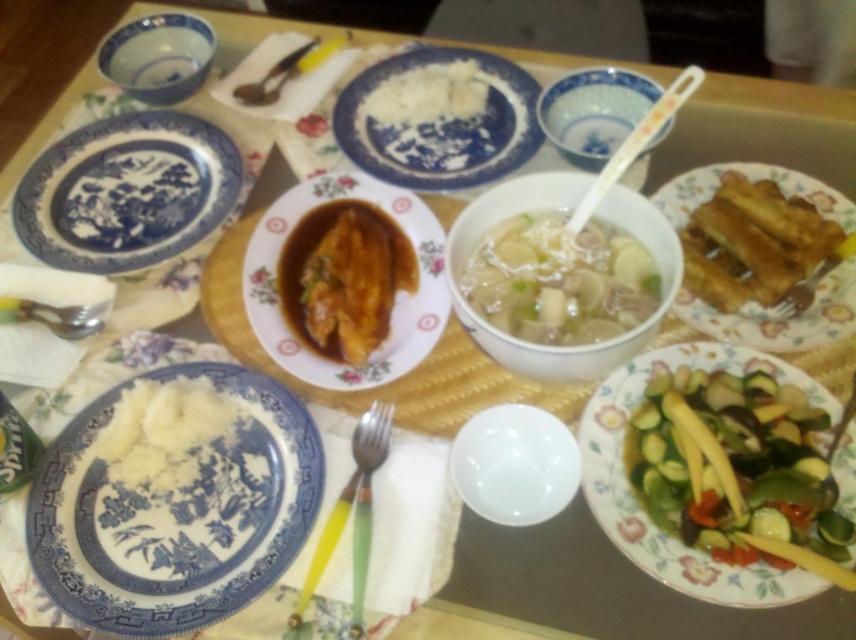
Question: Does blue porcelain bowl at upper left have a smaller size compared to green plastic fork at lower center?

Choices:
 (A) yes
 (B) no

Answer: (B)

Question: Is blue porcelain plate at center thinner than yellow-green plastic fork at center?

Choices:
 (A) no
 (B) yes

Answer: (A)

Question: Which of the following is the farthest from the observer?

Choices:
 (A) blue porcelain bowl at upper left
 (B) silver fork at right
 (C) white glossy bowl at center
 (D) silver metallic fork at center

Answer: (D)

Question: Is translucent glass soup at center to the left of yellow-green plastic fork at lower left from the viewer's perspective?

Choices:
 (A) no
 (B) yes

Answer: (A)

Question: Which point is closer to the camera?

Choices:
 (A) (188, 449)
 (B) (795, 333)

Answer: (A)

Question: Which object is the farthest from the white creamy mashed potato at lower left?

Choices:
 (A) yellow-green plastic fork at lower left
 (B) white porcelain plate at lower left
 (C) blue porcelain plate at center
 (D) translucent glass soup at center

Answer: (C)